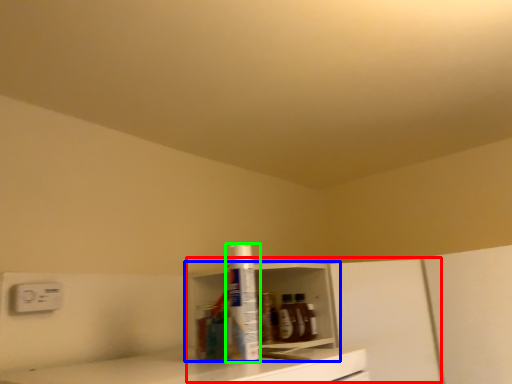
Question: Which object is positioned closest to cabinetry (highlighted by a red box)? Select from shelf (highlighted by a blue box) and bottle (highlighted by a green box).

Choices:
 (A) shelf
 (B) bottle

Answer: (A)